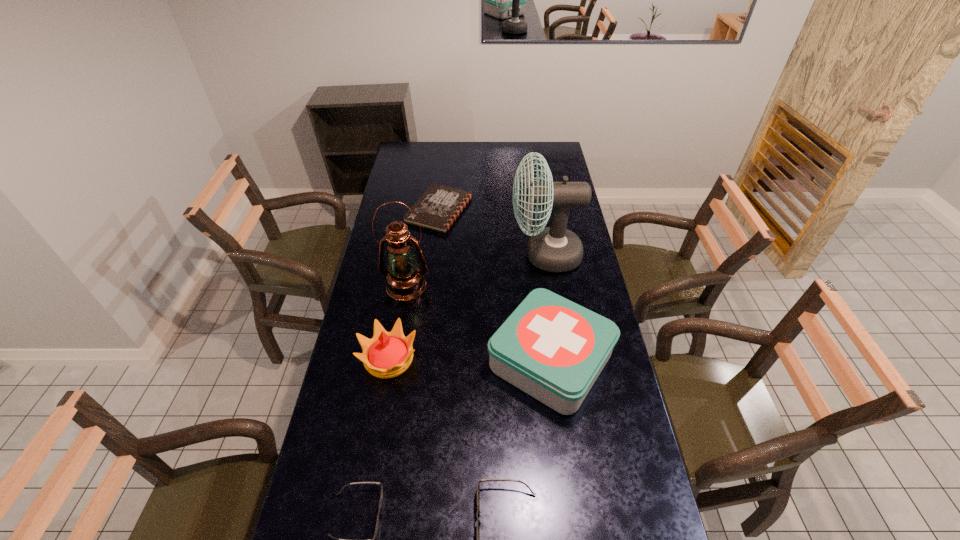
This screenshot has height=540, width=960. Find the location of `notebook`. notebook is located at coordinates point(439,206).

At what (x,y) coordinates should I click in order to perform the action: click on the first-aid kit. Please return your answer as a coordinate pair (x, y). The image size is (960, 540). Looking at the image, I should click on (553, 349).

I want to click on fan, so click(x=554, y=249).

The image size is (960, 540). I want to click on oil lamp, so click(x=405, y=281).

The height and width of the screenshot is (540, 960). What are the coordinates of `crown` in the screenshot? It's located at (388, 354).

Find the location of a particular element. The width and height of the screenshot is (960, 540). vacant space located 0.210m on the back of the notebook is located at coordinates (444, 166).

The width and height of the screenshot is (960, 540). What are the coordinates of `free space located on the back of the first-aid kit` in the screenshot? It's located at (x=540, y=282).

Identify the location of free point located 0.400m in front of the fan where the airflow is directed. (414, 255).

At what (x,y) coordinates should I click in order to perform the action: click on vacant space located in front of the fan where the airflow is directed. Please return your answer as a coordinate pair (x, y). Looking at the image, I should click on (443, 255).

Where is `vacant space located 0.090m in front of the fan where the airflow is directed`? This screenshot has height=540, width=960. vacant space located 0.090m in front of the fan where the airflow is directed is located at coordinates (488, 255).